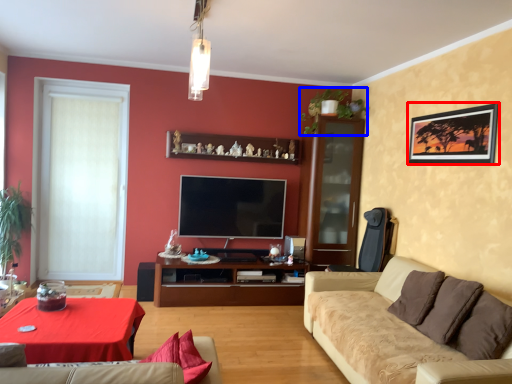
Question: Which point is further to the camera, picture frame (highlighted by a red box) or plant (highlighted by a blue box)?

Choices:
 (A) picture frame
 (B) plant

Answer: (B)